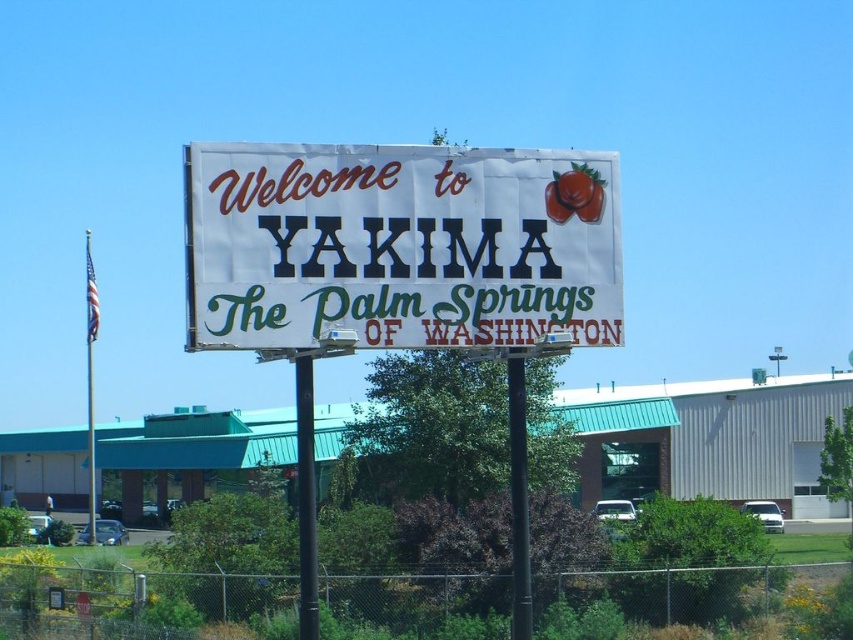
You are a painter who needs to choose between two items to paint first. You have to decide whether the white paper sign at center can be painted without needing to climb higher than the black metal pole at center. Can you do that?

The white paper sign at center is shorter than the black metal pole at center, so you can paint the white paper sign at center without needing to climb higher than the black metal pole at center.

You are standing in front of the billboard and see a point marked at coordinates (399,246). What object is located at that point?

The white paper sign at center is located at the point marked by coordinates (399,246).

You are a delivery driver who needs to park your truck near the white paper sign at center and the black metal pole at center. Since the truck is 2 meters wide, will it fit between them if they are positioned side by side?

The white paper sign at center is smaller than the black metal pole at center, but the description does not provide specific distance between them. Therefore, it is impossible to determine if the truck can fit between them based on the given information.